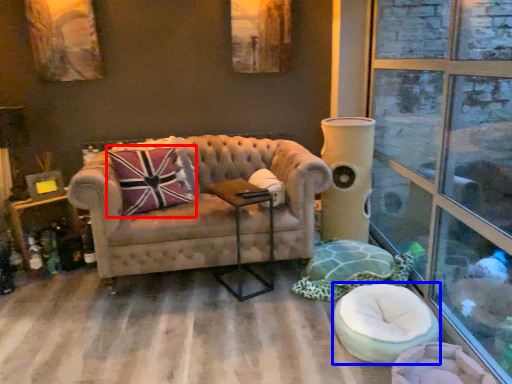
Question: Among these objects, which one is farthest to the camera, throw pillow (highlighted by a red box) or swivel chair (highlighted by a blue box)?

Choices:
 (A) throw pillow
 (B) swivel chair

Answer: (A)